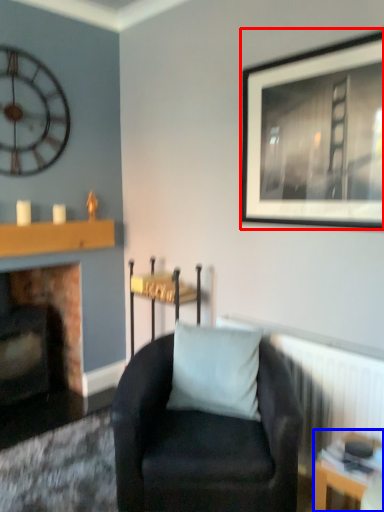
Question: Among these objects, which one is nearest to the camera, picture frame (highlighted by a red box) or table (highlighted by a blue box)?

Choices:
 (A) picture frame
 (B) table

Answer: (B)